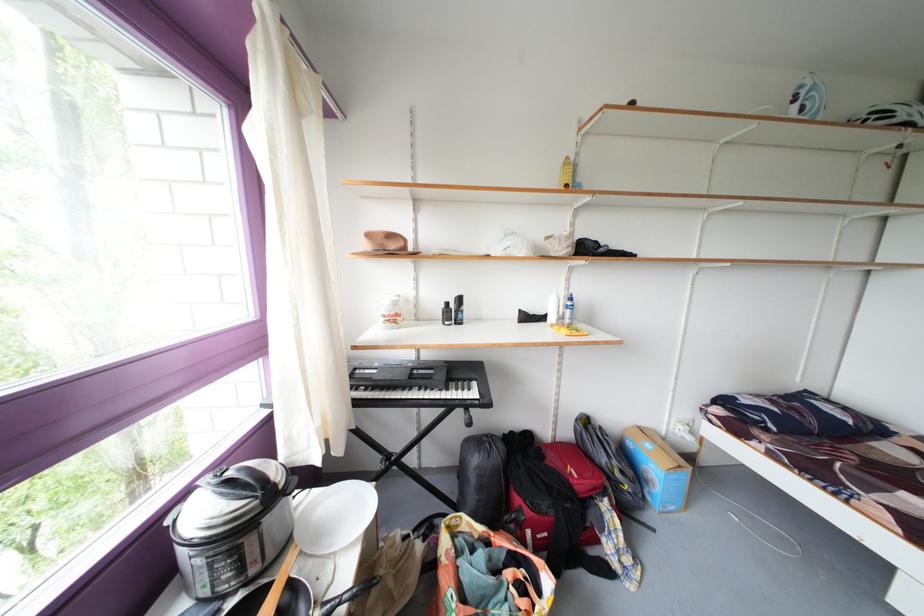
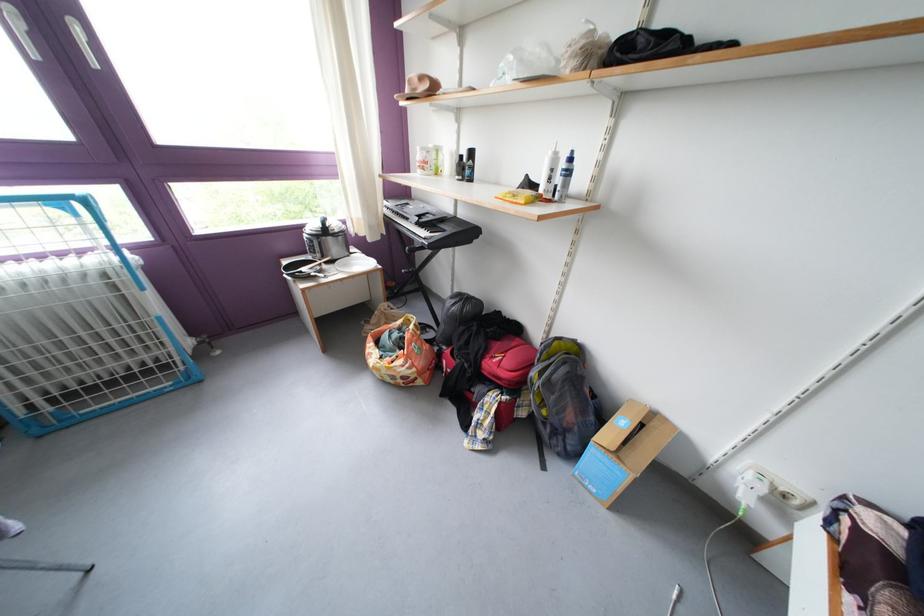
Where in the second image is the point corresponding to point 613,464 from the first image?

(543, 379)